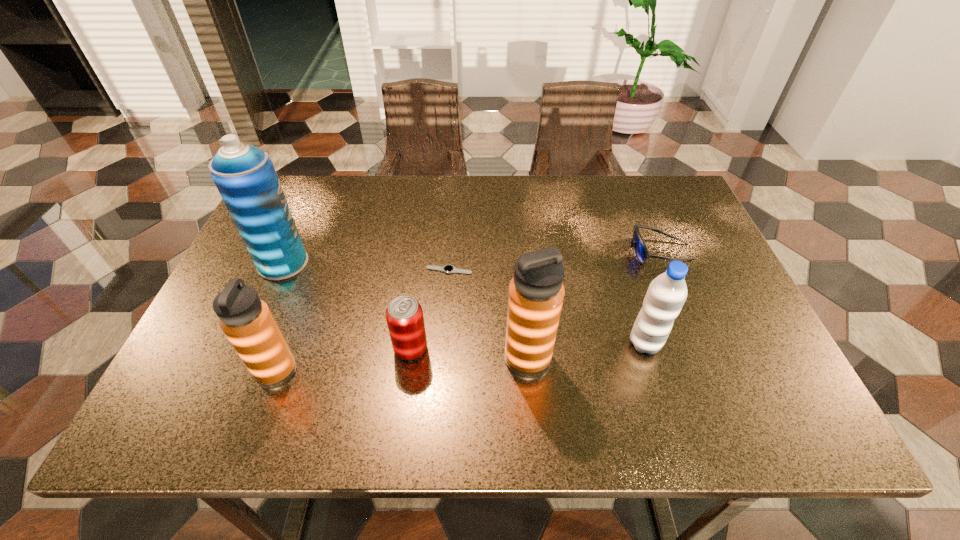
Please show where to add a thermos bottle on the right while keeping spacing even. Please provide its 2D coordinates. Your answer should be formatted as a tuple, i.e. [(x, y)], where the tuple contains the x and y coordinates of a point satisfying the conditions above.

[(767, 346)]